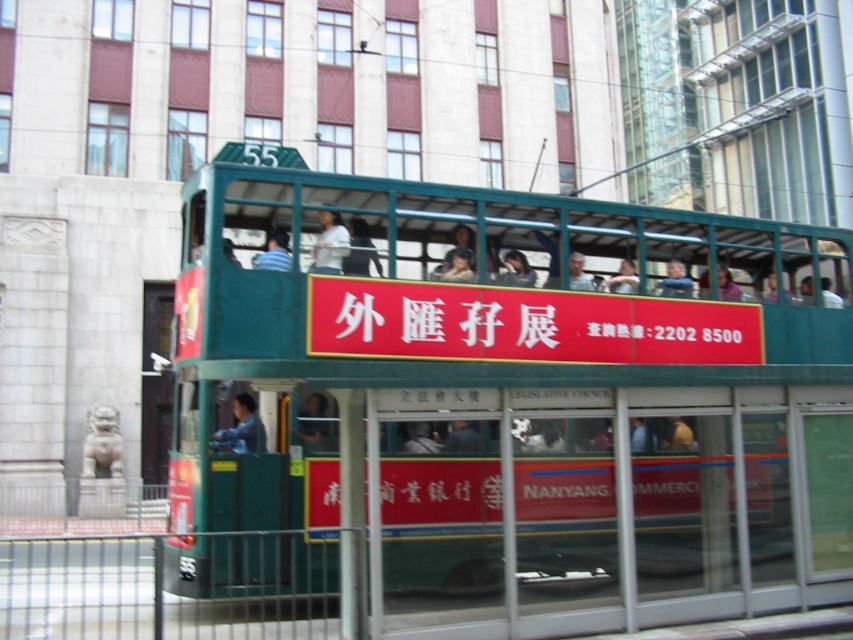
Question: Which is nearer to the green matte/deck bus at center?

Choices:
 (A) blue denim jacket at lower left
 (B) matte black hair at center
 (C) blue fabric shirt at center
 (D) blue striped shirt at center

Answer: (B)

Question: Observing the image, what is the correct spatial positioning of matte black hair at center in reference to matte black face at center?

Choices:
 (A) above
 (B) below

Answer: (A)

Question: Among these points, which one is nearest to the camera?

Choices:
 (A) (788, 301)
 (B) (683, 268)
 (C) (250, 413)

Answer: (C)

Question: Does matte green bus at center have a lesser width compared to matte black shirt at center?

Choices:
 (A) no
 (B) yes

Answer: (A)

Question: Which object is positioned closest to the blue denim jacket at lower left?

Choices:
 (A) matte blue shirt at center
 (B) blue striped shirt at center

Answer: (A)

Question: Is green matte/deck bus at center closer to the viewer compared to blue striped shirt at center?

Choices:
 (A) yes
 (B) no

Answer: (A)